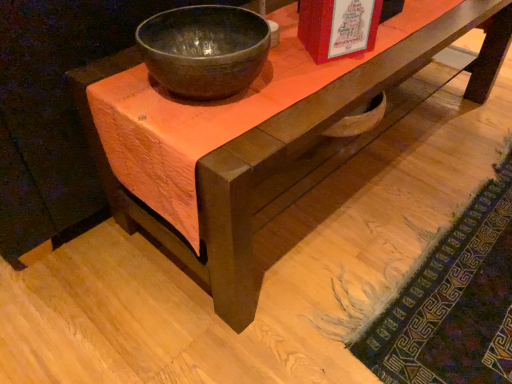
Question: Is textured wool mat at lower right positioned in front of matte red book at upper center?

Choices:
 (A) no
 (B) yes

Answer: (B)

Question: Is textured wool mat at lower right positioned beyond the bounds of matte red book at upper center?

Choices:
 (A) yes
 (B) no

Answer: (A)

Question: Is textured wool mat at lower right at the left side of matte red book at upper center?

Choices:
 (A) yes
 (B) no

Answer: (B)

Question: From the image's perspective, is textured wool mat at lower right beneath matte red book at upper center?

Choices:
 (A) yes
 (B) no

Answer: (A)

Question: Can you confirm if textured wool mat at lower right is smaller than matte red book at upper center?

Choices:
 (A) no
 (B) yes

Answer: (A)

Question: From a real-world perspective, is matte red book at upper center physically located above or below matte dark gray bowl at center?

Choices:
 (A) below
 (B) above

Answer: (B)

Question: From the image's perspective, is matte red book at upper center above or below matte dark gray bowl at center?

Choices:
 (A) above
 (B) below

Answer: (A)

Question: Based on their positions, is matte red book at upper center located to the left or right of matte dark gray bowl at center?

Choices:
 (A) left
 (B) right

Answer: (B)

Question: Is matte red book at upper center inside or outside of matte dark gray bowl at center?

Choices:
 (A) inside
 (B) outside

Answer: (B)

Question: Looking at their shapes, would you say textured wool mat at lower right is wider or thinner than matte dark gray bowl at center?

Choices:
 (A) wide
 (B) thin

Answer: (A)

Question: Based on their positions, is textured wool mat at lower right located to the left or right of matte dark gray bowl at center?

Choices:
 (A) right
 (B) left

Answer: (A)

Question: Do you think textured wool mat at lower right is within matte dark gray bowl at center, or outside of it?

Choices:
 (A) outside
 (B) inside

Answer: (A)

Question: Is point (488, 294) positioned closer to the camera than point (175, 16)?

Choices:
 (A) closer
 (B) farther

Answer: (B)

Question: Does point tap(244, 67) appear closer or farther from the camera than point tap(424, 379)?

Choices:
 (A) closer
 (B) farther

Answer: (A)

Question: Considering the positions of matte dark gray bowl at center and textured wool mat at lower right in the image, is matte dark gray bowl at center wider or thinner than textured wool mat at lower right?

Choices:
 (A) wide
 (B) thin

Answer: (B)